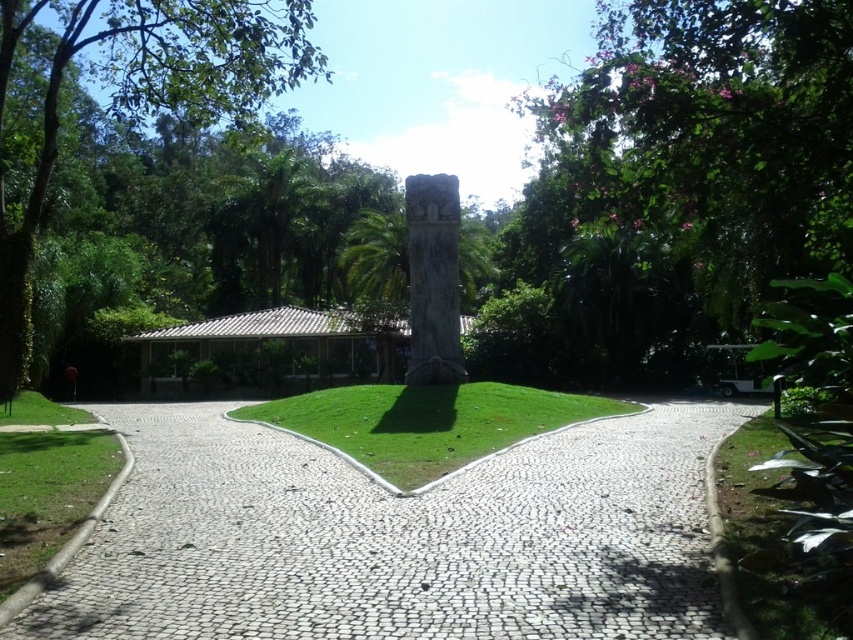
Question: Can you confirm if green leafy tree at upper right is thinner than green leafy tree at left?

Choices:
 (A) yes
 (B) no

Answer: (A)

Question: Which of these objects is positioned farthest from the green grass at lower left?

Choices:
 (A) green leafy tree at left
 (B) green grass at center
 (C) white cobblestone path at center
 (D) green leafy tree at upper right

Answer: (D)

Question: Is the position of white cobblestone path at center more distant than that of green grass at center?

Choices:
 (A) yes
 (B) no

Answer: (B)

Question: Which point appears farthest from the camera in this image?

Choices:
 (A) (474, 410)
 (B) (4, 518)
 (C) (637, 508)
 (D) (607, 276)

Answer: (D)

Question: Which object is closer to the camera taking this photo?

Choices:
 (A) green grass at center
 (B) green leafy tree at left
 (C) green grass at lower left
 (D) green leafy tree at upper right

Answer: (C)

Question: Is green leafy tree at upper right bigger than green leafy tree at left?

Choices:
 (A) no
 (B) yes

Answer: (A)